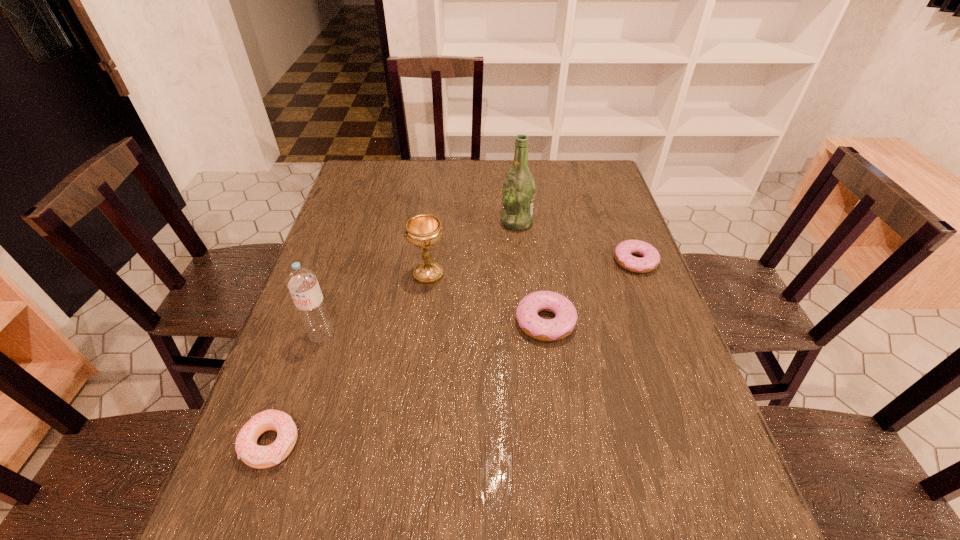
Find the location of a particular element. This screenshot has width=960, height=540. the second nearest doughnut is located at coordinates click(x=547, y=330).

The height and width of the screenshot is (540, 960). I want to click on the shortest object, so click(650, 260).

Where is `the farthest doughnut`? The image size is (960, 540). the farthest doughnut is located at coordinates (x=650, y=260).

This screenshot has width=960, height=540. In order to click on the fifth shortest object in this screenshot , I will do `click(301, 281)`.

In order to click on the tallest object in this screenshot , I will do `click(519, 187)`.

Find the location of a particular element. This screenshot has width=960, height=540. beer bottle is located at coordinates (519, 187).

Where is `the third object from left to right`? This screenshot has width=960, height=540. the third object from left to right is located at coordinates (423, 230).

Find the location of `chalice`. chalice is located at coordinates (423, 230).

Where is `the nearest doughnut`? Image resolution: width=960 pixels, height=540 pixels. the nearest doughnut is located at coordinates 256,456.

I want to click on the nearest object, so pos(256,456).